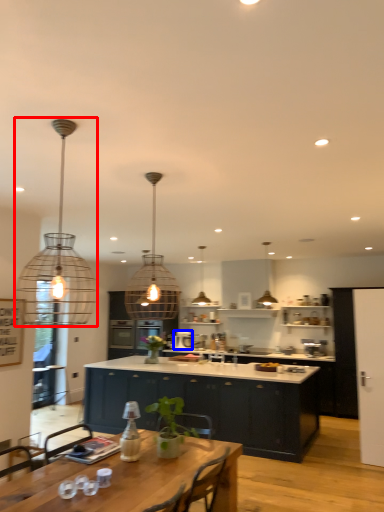
Question: Among these objects, which one is nearest to the camera, lamp (highlighted by a red box) or appliance (highlighted by a blue box)?

Choices:
 (A) lamp
 (B) appliance

Answer: (A)